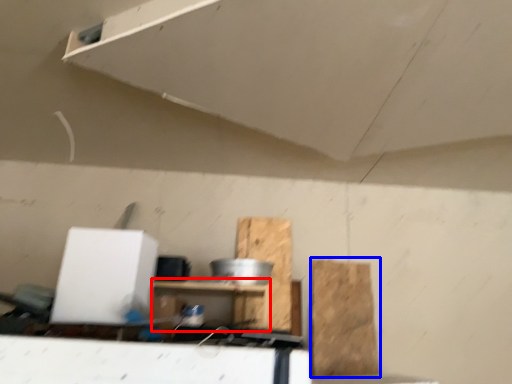
Question: Among these objects, which one is nearest to the camera, furniture (highlighted by a red box) or cardboard (highlighted by a blue box)?

Choices:
 (A) furniture
 (B) cardboard

Answer: (A)